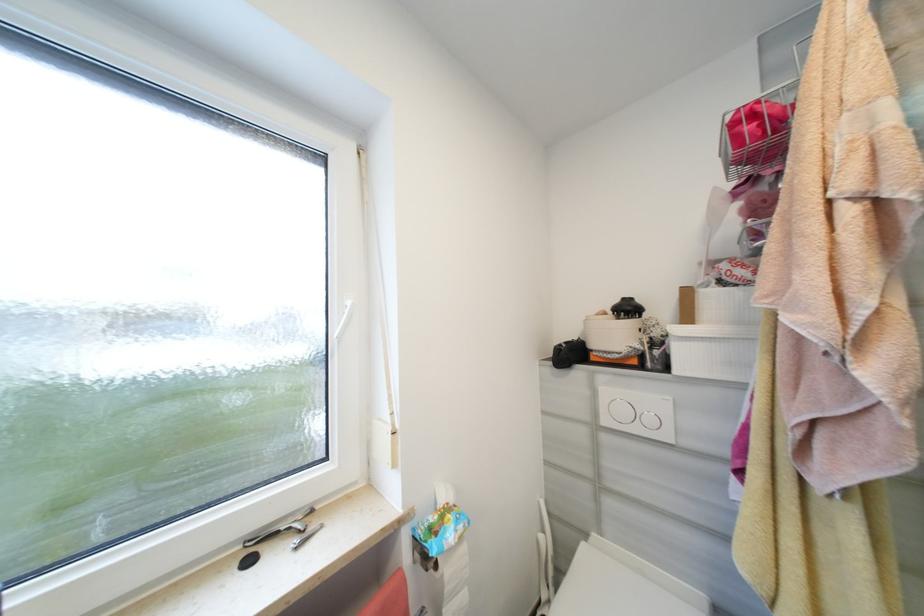
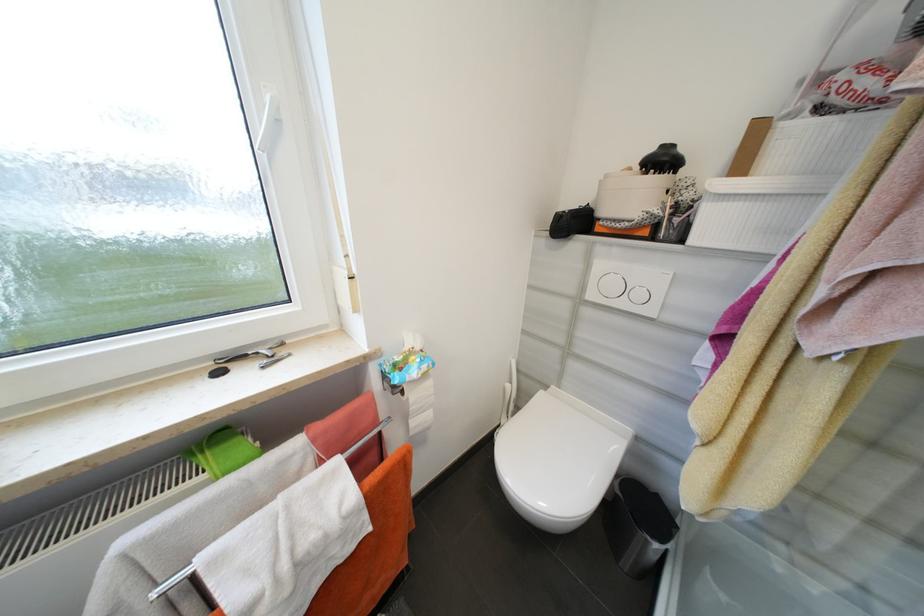
Where in the second image is the point corresponding to point 442,567 from the first image?

(407, 392)